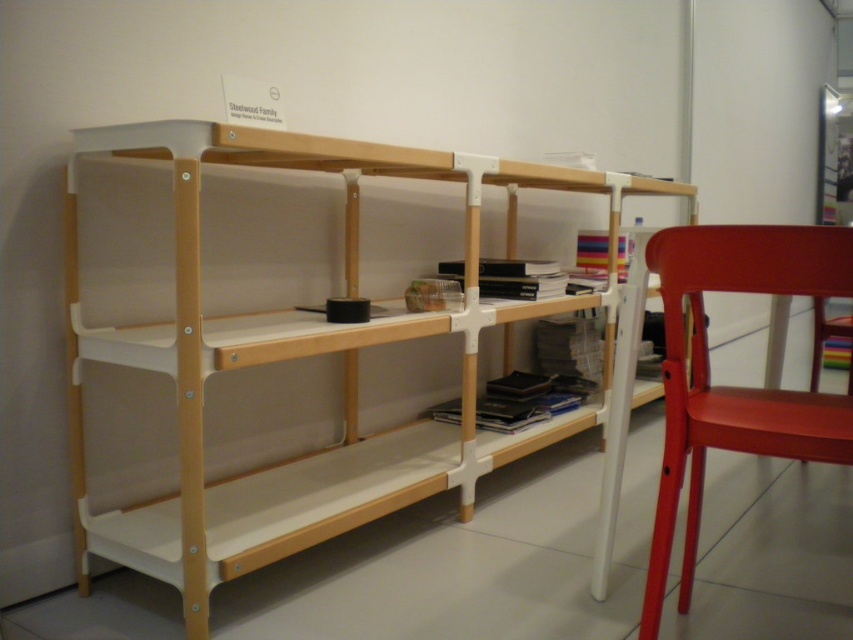
Who is positioned more to the left, white matte bookshelf at center or matte red chair at right?

Positioned to the left is white matte bookshelf at center.

Who is more distant from viewer, (173, 339) or (689, 289)?

The point (173, 339) is behind.

The width and height of the screenshot is (853, 640). I want to click on white matte bookshelf at center, so click(x=305, y=356).

What are the coordinates of `white matte bookshelf at center` in the screenshot? It's located at point(305,356).